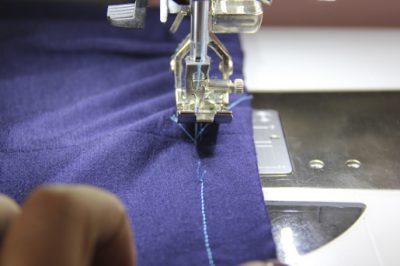
Find the location of a particular element. The image size is (400, 266). white surface of sewing machine is located at coordinates (384, 221), (331, 70).